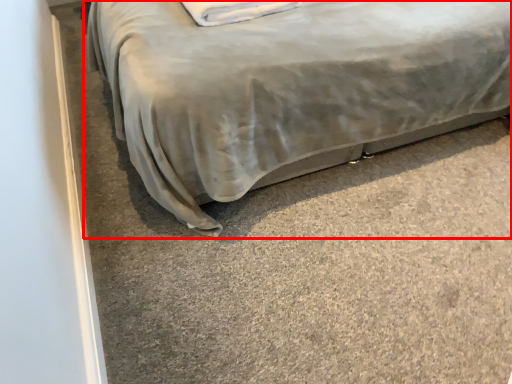
Question: From the image's perspective, where is bed (annotated by the red box) located in relation to pillow in the image?

Choices:
 (A) above
 (B) below

Answer: (A)